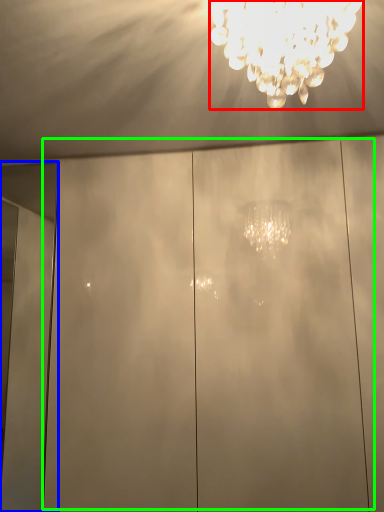
Question: Which object is the farthest from lamp (highlighted by a red box)? Choose among these: door (highlighted by a blue box) or glass door (highlighted by a green box).

Choices:
 (A) door
 (B) glass door

Answer: (A)